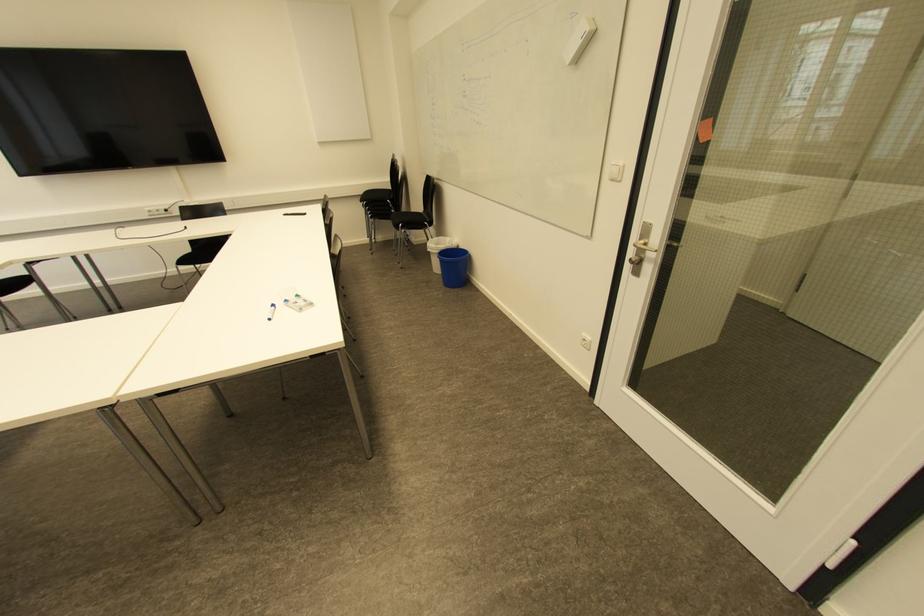
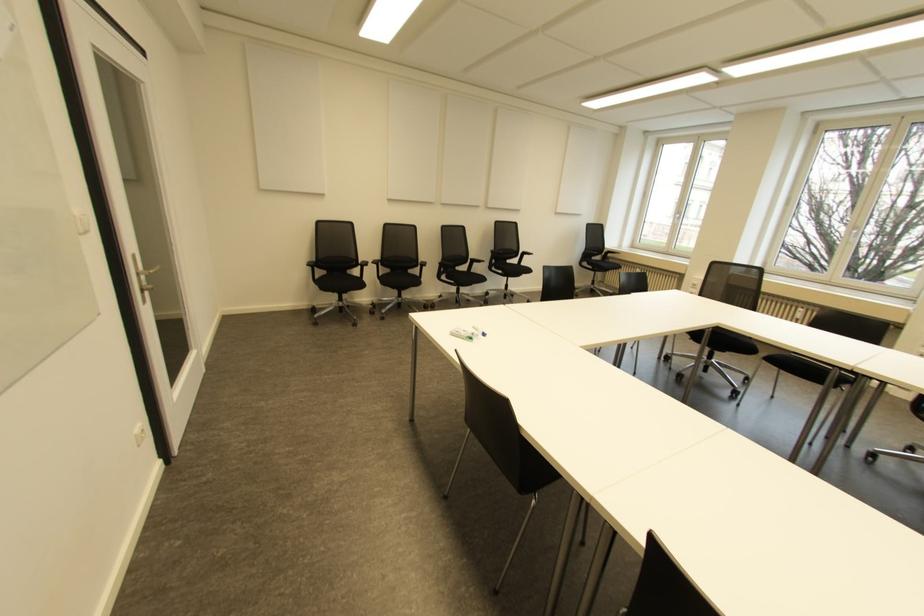
Where in the second image is the point corresponding to the point at 297,294 from the first image?

(470, 338)